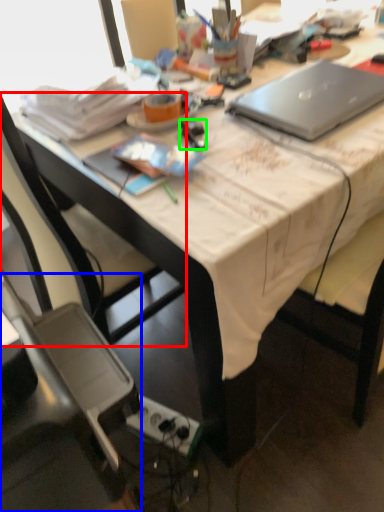
Question: Estimate the real-world distances between objects in this image. Which object is farther from chair (highlighted by a red box), chair (highlighted by a blue box) or stationery (highlighted by a green box)?

Choices:
 (A) chair
 (B) stationery

Answer: (B)